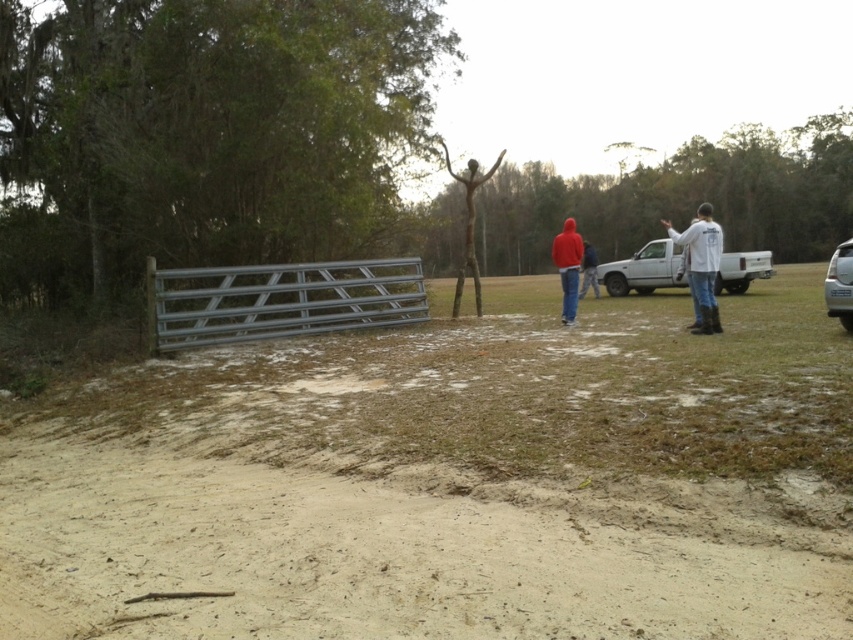
In the scene shown: You are a photographer planning to take a group photo of the white matte shirt at right and the red matte hoodie at center. To ensure both subjects are in focus, you need to know which one is closer to the camera. Can you determine which is nearer based on their sizes?

The white matte shirt at right has a larger size compared to the red matte hoodie at center, so it appears closer to the camera.

You are standing at the origin point of the coordinate system. You want to walk to the white matte shirt at right. What direction should you move in?

The white matte shirt at right is located at coordinate point (701, 266), so you should move towards the northeast direction to reach it.